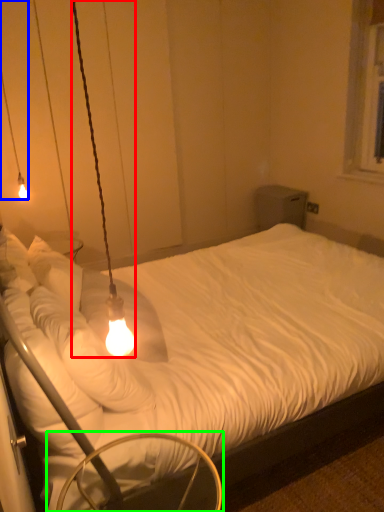
Question: Estimate the real-world distances between objects in this image. Which object is farther from lamp (highlighted by a red box), lamp (highlighted by a blue box) or swivel chair (highlighted by a green box)?

Choices:
 (A) lamp
 (B) swivel chair

Answer: (A)